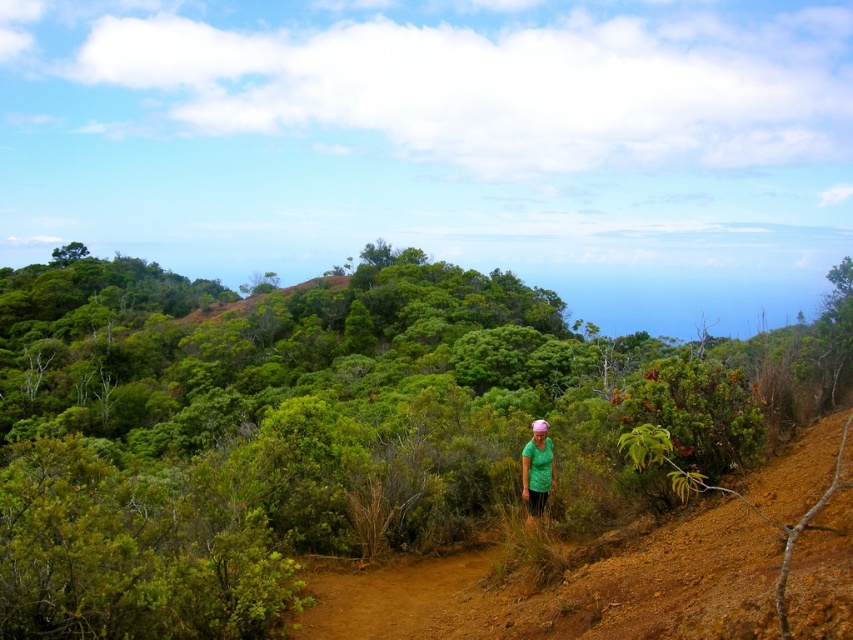
Question: Considering the relative positions of green leafy shrubs at center and green matte shirt at center in the image provided, where is green leafy shrubs at center located with respect to green matte shirt at center?

Choices:
 (A) above
 (B) below

Answer: (A)

Question: Which of the following is the closest to the observer?

Choices:
 (A) green matte shirt at center
 (B) green leafy shrubs at center

Answer: (B)

Question: Which object is closer to the camera taking this photo?

Choices:
 (A) green leafy shrubs at center
 (B) green matte shirt at center

Answer: (A)

Question: Observing the image, what is the correct spatial positioning of green leafy shrubs at center in reference to green matte shirt at center?

Choices:
 (A) right
 (B) left

Answer: (B)

Question: Which of the following is the farthest from the observer?

Choices:
 (A) (85, 326)
 (B) (547, 436)

Answer: (A)

Question: Is green leafy shrubs at center wider than green matte shirt at center?

Choices:
 (A) yes
 (B) no

Answer: (A)